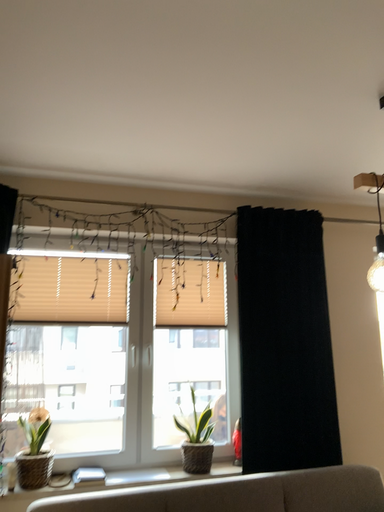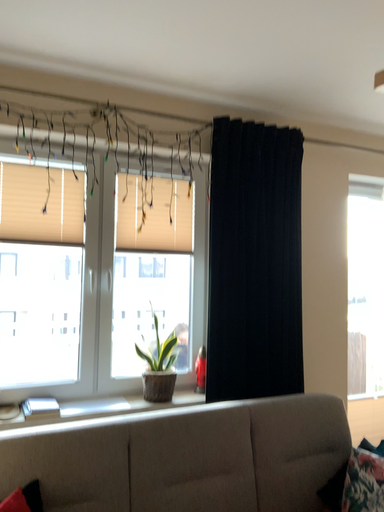
Question: How did the camera likely rotate when shooting the video?

Choices:
 (A) rotated left
 (B) rotated right

Answer: (B)